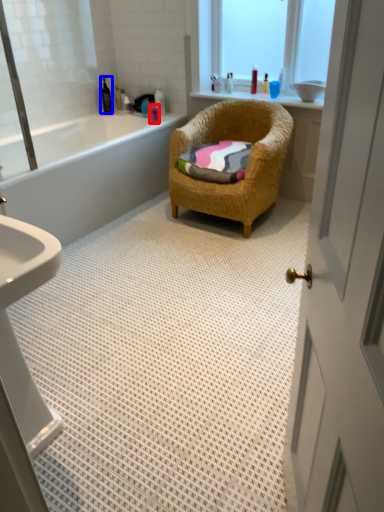
Question: Which point is closer to the camera, toiletry (highlighted by a red box) or toiletry (highlighted by a blue box)?

Choices:
 (A) toiletry
 (B) toiletry

Answer: (A)